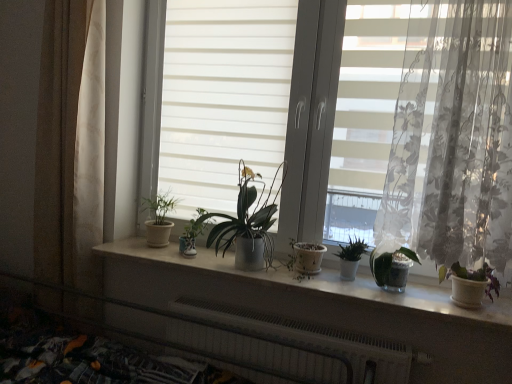
This screenshot has height=384, width=512. I want to click on unoccupied area in front of green matte plant at center, which ranks as the 2th houseplant in left-to-right order, so click(x=190, y=261).